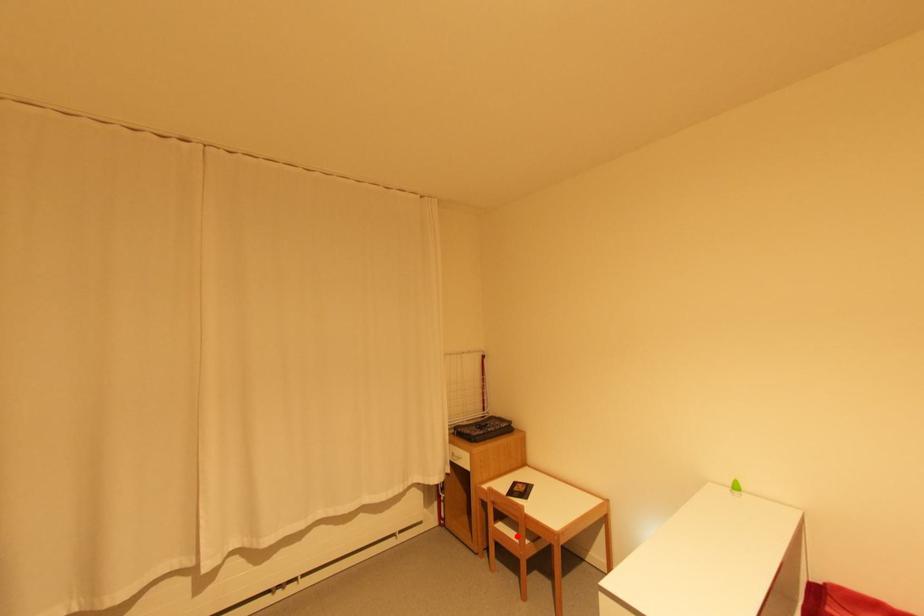
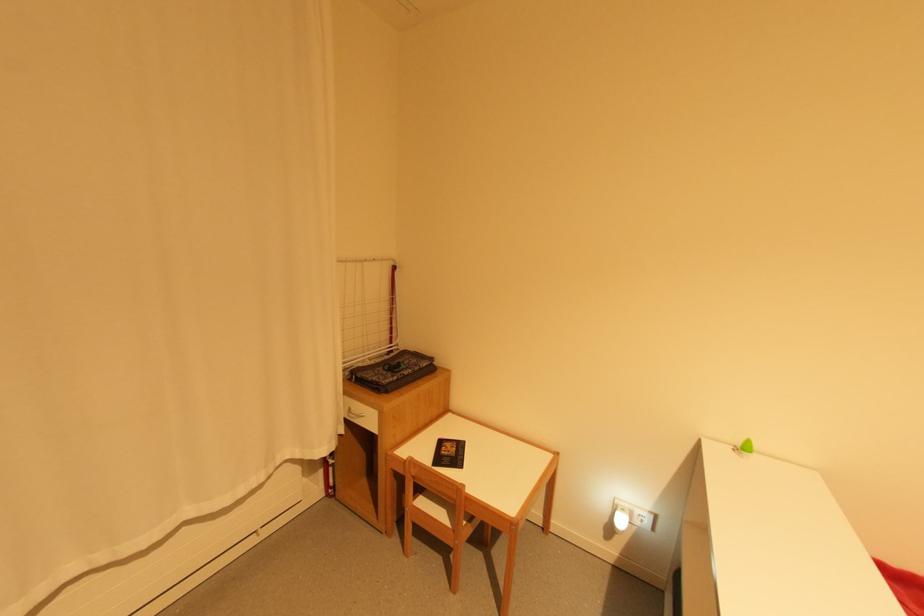
In the second image, find the point that corresponds to the highlighted location in the first image.

(445, 515)